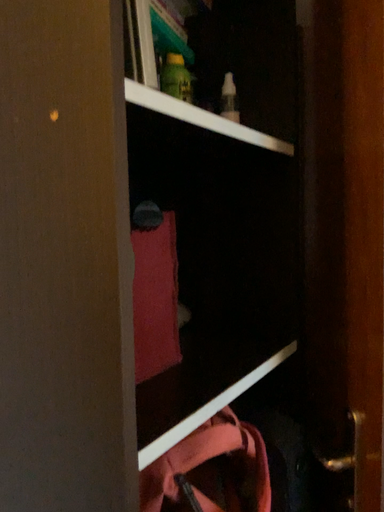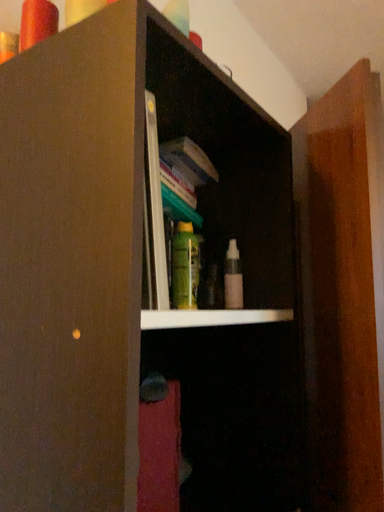
Question: How did the camera likely rotate when shooting the video?

Choices:
 (A) rotated upward
 (B) rotated downward

Answer: (A)